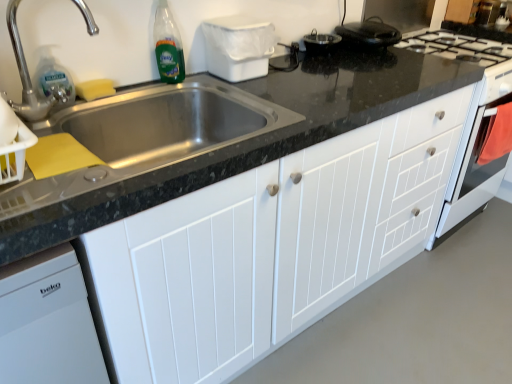
Question: Does white wood cabinet at center have a lesser width compared to silver metallic faucet at upper left?

Choices:
 (A) no
 (B) yes

Answer: (A)

Question: Does white wood cabinet at center have a greater height compared to silver metallic faucet at upper left?

Choices:
 (A) yes
 (B) no

Answer: (A)

Question: Can you confirm if white wood cabinet at center is smaller than silver metallic faucet at upper left?

Choices:
 (A) no
 (B) yes

Answer: (A)

Question: Is white wood cabinet at center to the left of silver metallic faucet at upper left from the viewer's perspective?

Choices:
 (A) yes
 (B) no

Answer: (B)

Question: Can you confirm if white wood cabinet at center is wider than silver metallic faucet at upper left?

Choices:
 (A) no
 (B) yes

Answer: (B)

Question: Is white wood cabinet at center bigger than silver metallic faucet at upper left?

Choices:
 (A) yes
 (B) no

Answer: (A)

Question: Is silver metallic faucet at upper left bigger than green glass bottle at upper left?

Choices:
 (A) no
 (B) yes

Answer: (B)

Question: Does silver metallic faucet at upper left appear on the left side of green glass bottle at upper left?

Choices:
 (A) no
 (B) yes

Answer: (B)

Question: Can you confirm if silver metallic faucet at upper left is positioned to the right of green glass bottle at upper left?

Choices:
 (A) yes
 (B) no

Answer: (B)

Question: From the image's perspective, is silver metallic faucet at upper left under green glass bottle at upper left?

Choices:
 (A) yes
 (B) no

Answer: (A)

Question: From a real-world perspective, does silver metallic faucet at upper left stand above green glass bottle at upper left?

Choices:
 (A) no
 (B) yes

Answer: (B)

Question: Does silver metallic faucet at upper left come behind green glass bottle at upper left?

Choices:
 (A) no
 (B) yes

Answer: (A)

Question: Is white wood cabinet at center a part of silver metallic faucet at upper left?

Choices:
 (A) yes
 (B) no

Answer: (B)